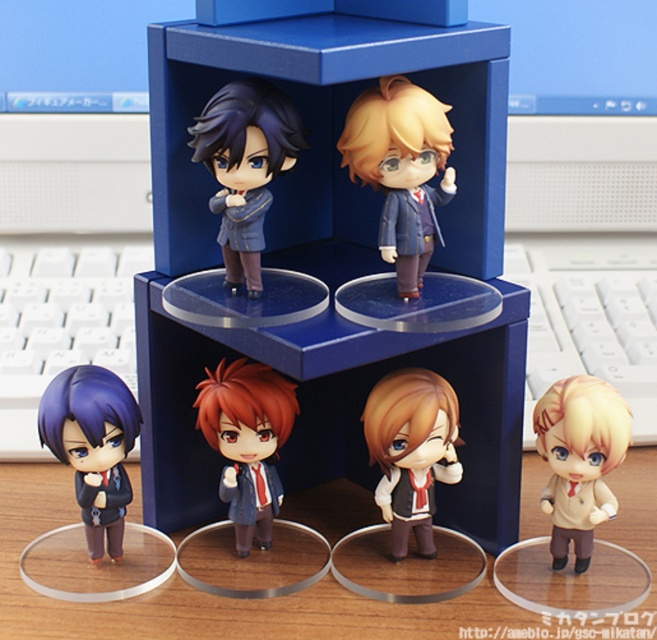
You are a collector who wants to display the matte black suit at lower left and the matte red hair doll at center on a shelf. Which one should you place on the lower shelf to ensure proper visibility of both?

The matte black suit at lower left is shorter than the matte red hair doll at center, so you should place the shorter matte black suit at lower left on the lower shelf to ensure proper visibility of both.

You are a collector organizing your figurines. You have a shelf that can only hold items up to 10 inches tall. You see the matte brown vest at center and the matte black suit at lower left. Which of these two figurines can safely fit on the shelf?

The matte brown vest at center is shorter than the matte black suit at lower left, so the matte brown vest at center can safely fit on the shelf if it is under 10 inches. However, the exact height isn

You are organizing a display of these figurines and need to place a new figurine between the matte blue uniform at upper left and the matte red hair doll at center. Based on their current positions, where should you place the new figurine relative to the existing ones?

The matte blue uniform at upper left is above the matte red hair doll at center, so you should place the new figurine between them either below the matte blue uniform at upper left or above the matte red hair doll at center to maintain the vertical arrangement.